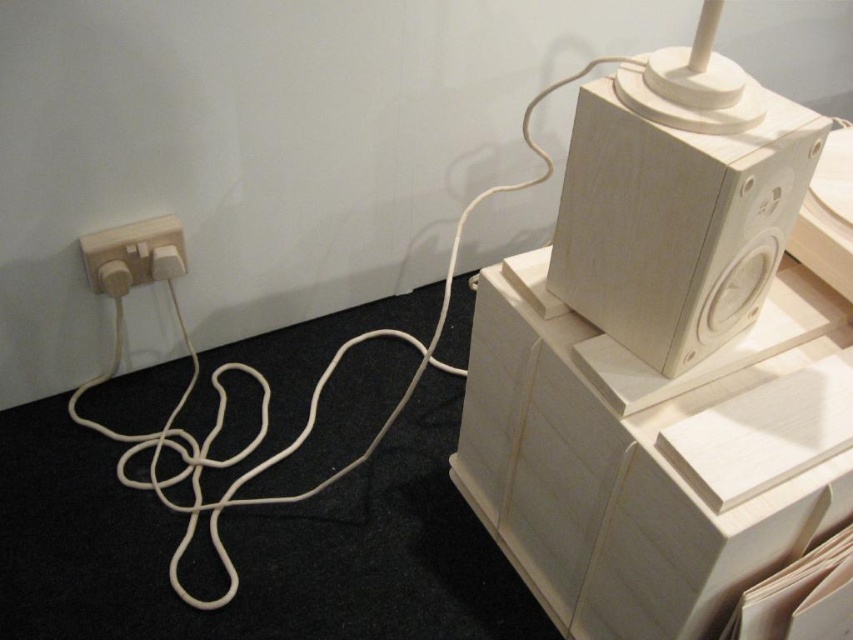
Based on the photo, you are setting up a new speaker system and need to connect the wooden speaker at upper right to the white matte electrical outlet at lower left. Based on the scene, will the speaker be positioned above or below the outlet?

The wooden speaker at upper right is above the white matte electrical outlet at lower left, so the speaker will be positioned above the outlet.

You are setting up a small speaker system. You have a white matte rope at lower left and a wooden speaker on wooden blocks. You want to secure the cable to the table so it doesn

The white matte rope at lower left is 32.69 inches away from the wooden speaker on wooden blocks. Since the distance is significant, you can secure the cable to the table near the white matte rope at lower left to keep it organized without obstructing the speaker.

You are setting up a minimalist room and need to place the white matte rope at lower left and the white matte electrical outlet at lower left. According to the scene, which object is positioned to the right side?

The white matte rope at lower left is positioned to the right of the white matte electrical outlet at lower left.